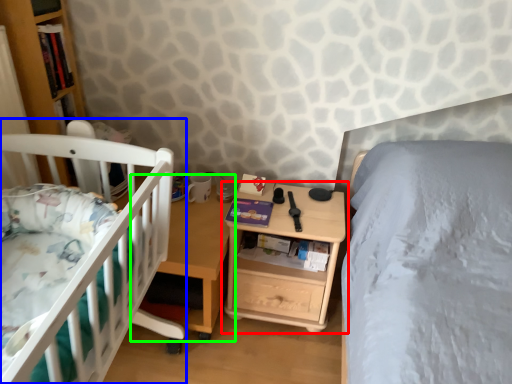
Question: Which object is the farthest from nightstand (highlighted by a red box)? Choose among these: infant bed (highlighted by a blue box) or table (highlighted by a green box).

Choices:
 (A) infant bed
 (B) table

Answer: (A)